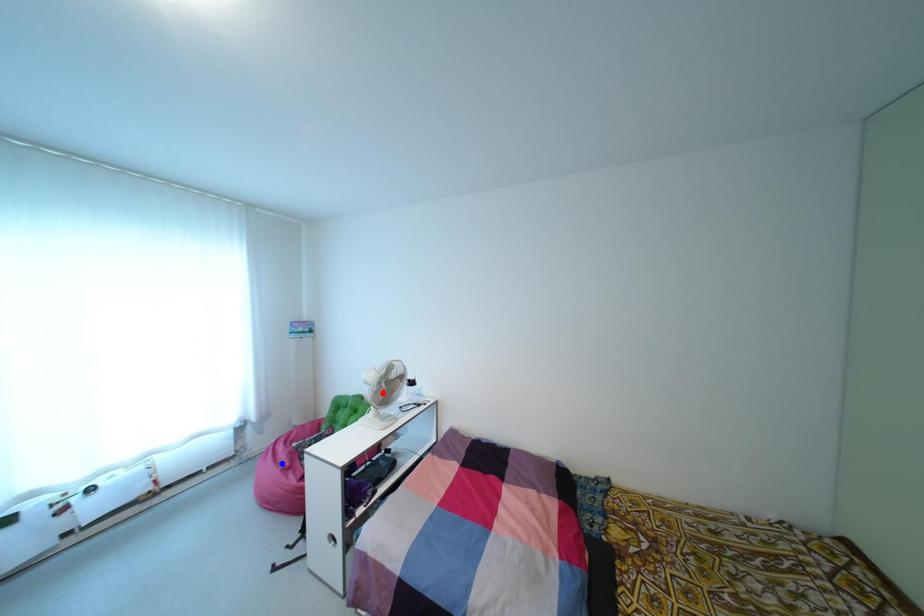
Question: Two points are marked on the image. Which point is closer to the camera?

Choices:
 (A) Blue point is closer.
 (B) Red point is closer.

Answer: (B)